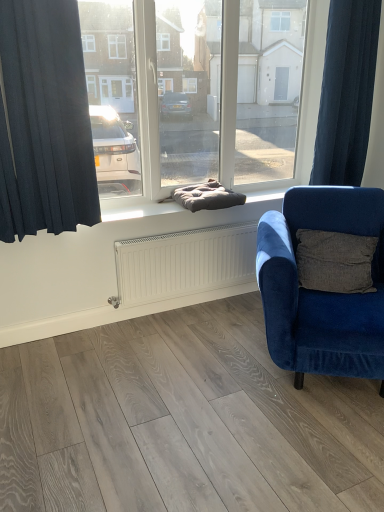
Question: From a real-world perspective, is dark gray cushion at center under velvet blue armchair at right?

Choices:
 (A) yes
 (B) no

Answer: (B)

Question: Is dark gray cushion at center taller than velvet blue armchair at right?

Choices:
 (A) no
 (B) yes

Answer: (A)

Question: Is dark gray cushion at center to the left of velvet blue armchair at right from the viewer's perspective?

Choices:
 (A) no
 (B) yes

Answer: (B)

Question: Is dark gray cushion at center placed right next to velvet blue armchair at right?

Choices:
 (A) yes
 (B) no

Answer: (B)

Question: From the image's perspective, does dark gray cushion at center appear lower than velvet blue armchair at right?

Choices:
 (A) no
 (B) yes

Answer: (A)

Question: Would you say velvet blue armchair at right is to the left or to the right of dark blue fabric curtain at left, marked as the second curtain in a right-to-left arrangement, in the picture?

Choices:
 (A) right
 (B) left

Answer: (A)

Question: From a real-world perspective, is velvet blue armchair at right above or below dark blue fabric curtain at left, arranged as the 2th curtain when viewed from the back?

Choices:
 (A) below
 (B) above

Answer: (A)

Question: Considering the positions of point (266, 260) and point (23, 109), is point (266, 260) closer or farther from the camera than point (23, 109)?

Choices:
 (A) closer
 (B) farther

Answer: (A)

Question: Is velvet blue armchair at right in front of or behind dark blue fabric curtain at left, the first curtain in the front-to-back sequence, in the image?

Choices:
 (A) behind
 (B) front

Answer: (B)

Question: Is dark blue fabric curtain at right, which is the first curtain in back-to-front order, in front of or behind dark blue fabric curtain at left, arranged as the 2th curtain when viewed from the back, in the image?

Choices:
 (A) front
 (B) behind

Answer: (B)

Question: Considering the positions of dark blue fabric curtain at right, marked as the 2th curtain in a left-to-right arrangement, and dark blue fabric curtain at left, the first curtain in the front-to-back sequence, in the image, is dark blue fabric curtain at right, marked as the 2th curtain in a left-to-right arrangement, taller or shorter than dark blue fabric curtain at left, the first curtain in the front-to-back sequence,?

Choices:
 (A) short
 (B) tall

Answer: (B)

Question: In terms of size, does dark blue fabric curtain at right, which is the first curtain in back-to-front order, appear bigger or smaller than dark blue fabric curtain at left, marked as the second curtain in a right-to-left arrangement?

Choices:
 (A) big
 (B) small

Answer: (A)

Question: From a real-world perspective, relative to dark blue fabric curtain at left, arranged as the 2th curtain when viewed from the back, is dark blue fabric curtain at right, marked as the 2th curtain in a left-to-right arrangement, vertically above or below?

Choices:
 (A) below
 (B) above

Answer: (B)

Question: In terms of width, does dark gray cushion at center look wider or thinner when compared to velvet blue armchair at right?

Choices:
 (A) thin
 (B) wide

Answer: (A)

Question: Relative to velvet blue armchair at right, is dark gray cushion at center in front or behind?

Choices:
 (A) front
 (B) behind

Answer: (B)